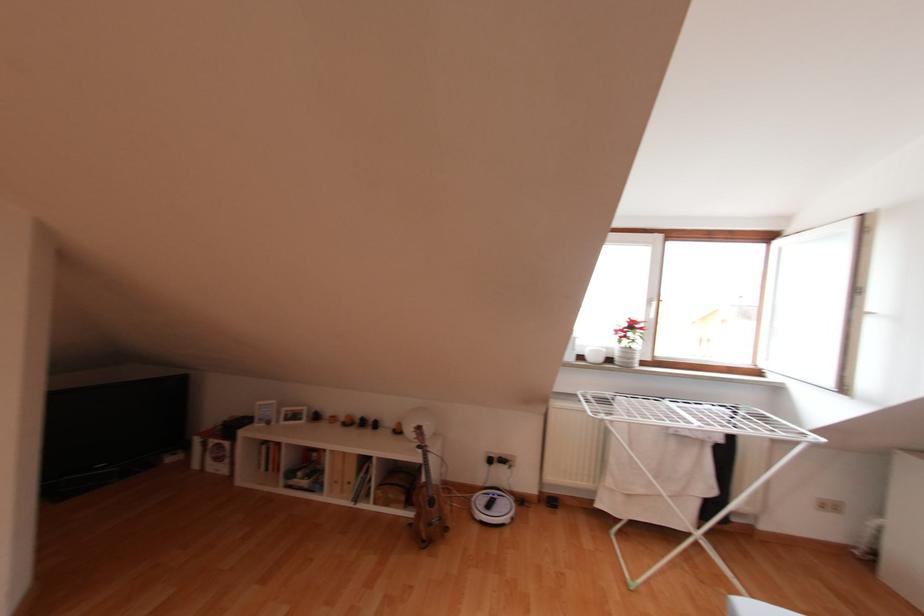
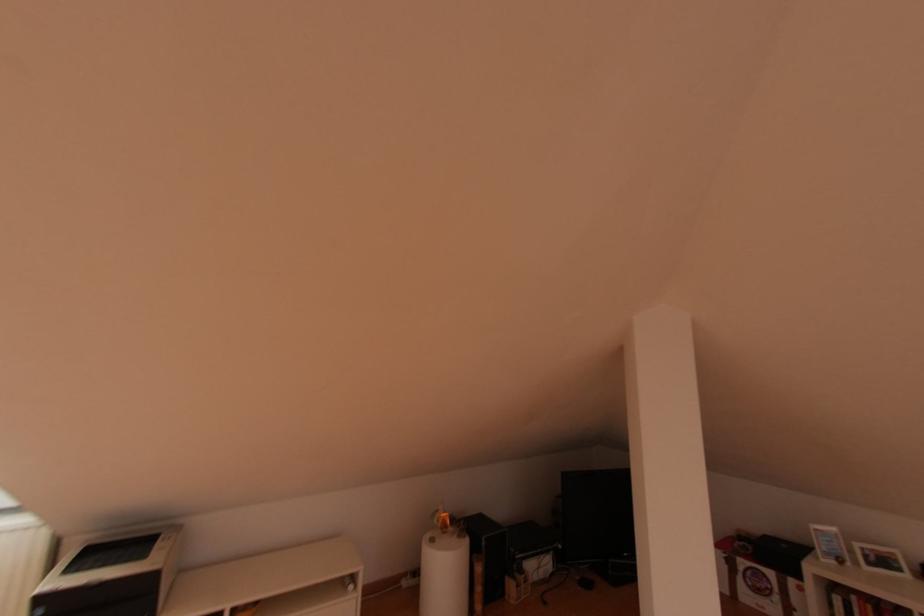
Locate, in the second image, the point that corresponds to point (286, 419) in the first image.

(869, 564)